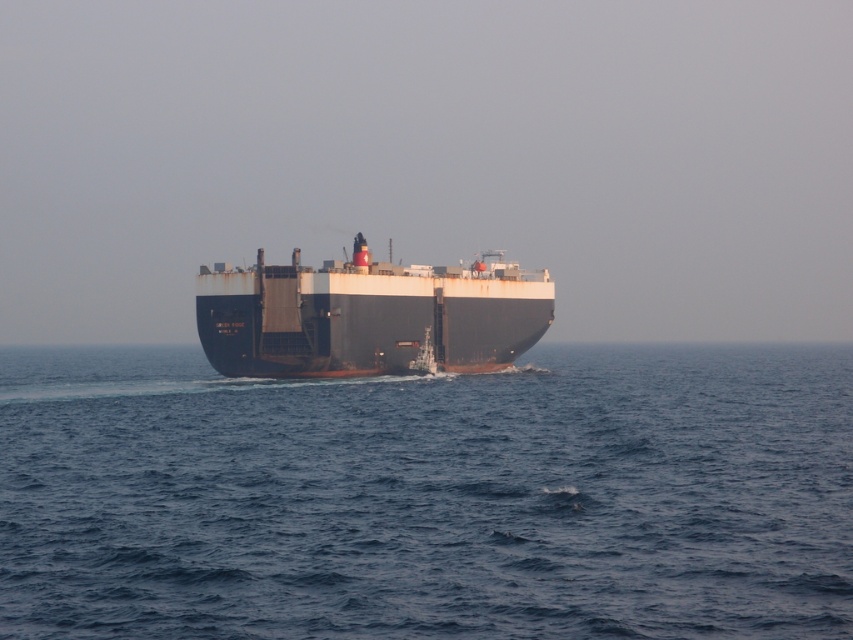
You are an observer on a nearby boat. You notice the blue water at center and the rustic metal ship at center in the distance. Which one takes up more visual space in your view?

The rustic metal ship at center takes up more visual space than the blue water at center because the blue water at center occupies less space than rustic metal ship at center.

You are an observer standing on the deck of the rustic metal ship at center. Looking around, you notice the blue water at center. Which object is taller from your vantage point?

The rustic metal ship at center is taller than the blue water at center because the blue water at center is not as tall as rustic metal ship at center.